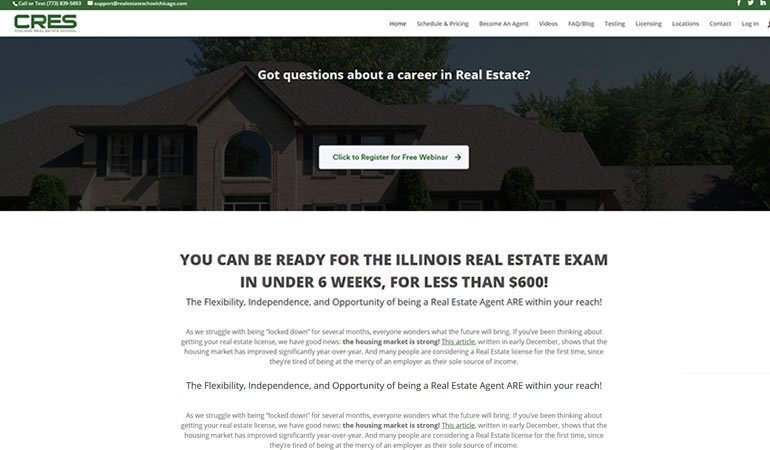
You are a GUI agent. You are given a task and a screenshot of the screen. Output one action in this format:
    pyautogui.click(x=<x>, y=<y>)
    Task: Click on the windows
    
    Given the screenshot: What is the action you would take?
    pyautogui.click(x=243, y=148), pyautogui.click(x=119, y=144)